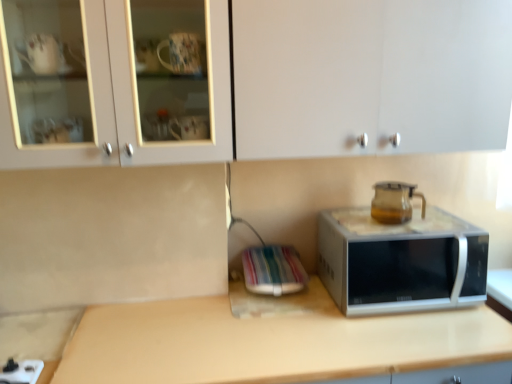
Locate an element on the screen. Image resolution: width=512 pixels, height=384 pixels. free spot above beige laminate countertop at center (from a real-world perspective) is located at coordinates (271, 327).